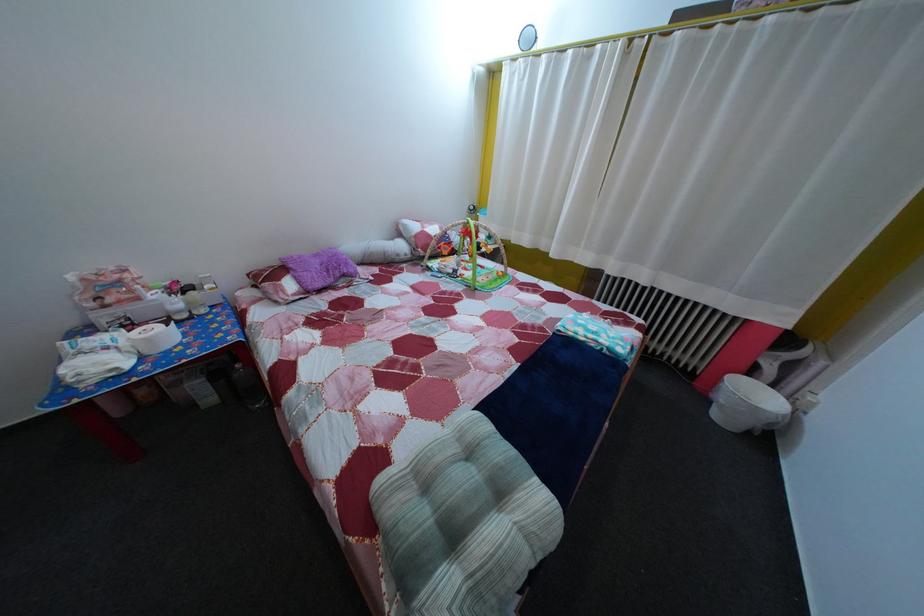
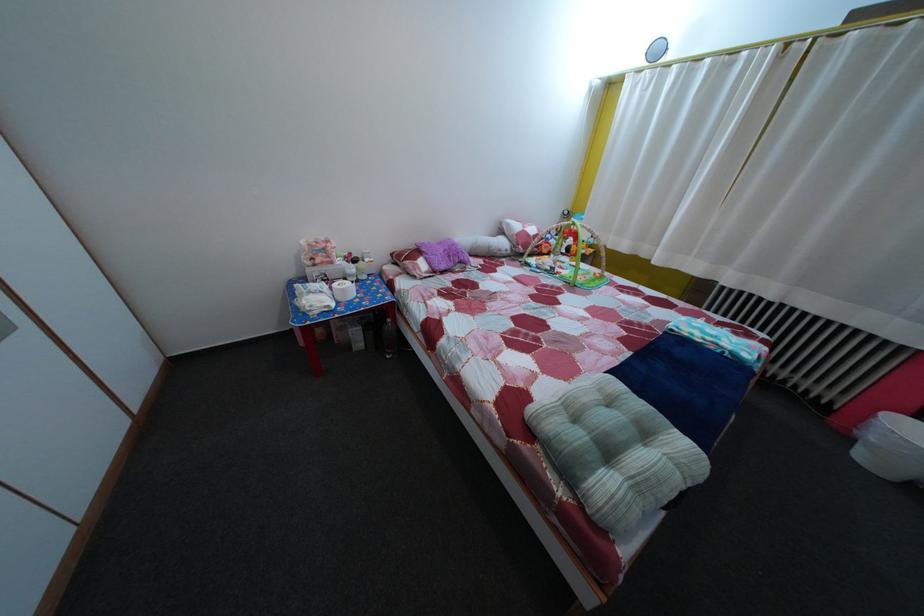
In the second image, find the point that corresponds to point 718,410 in the first image.

(860, 447)